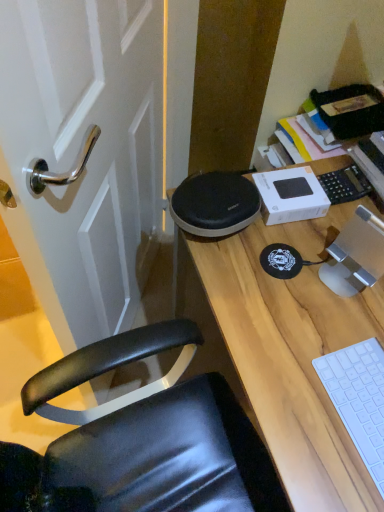
Question: Is white plastic keyboard at lower right situated inside wooden desk at center or outside?

Choices:
 (A) inside
 (B) outside

Answer: (A)

Question: From the image's perspective, relative to wooden desk at center, is white plastic keyboard at lower right above or below?

Choices:
 (A) below
 (B) above

Answer: (B)

Question: Is white plastic keyboard at lower right to the left or to the right of wooden desk at center in the image?

Choices:
 (A) right
 (B) left

Answer: (B)

Question: Would you say wooden desk at center is to the left or to the right of white plastic keyboard at lower right in the picture?

Choices:
 (A) left
 (B) right

Answer: (B)

Question: From a real-world perspective, is wooden desk at center above or below white plastic keyboard at lower right?

Choices:
 (A) below
 (B) above

Answer: (A)

Question: Is wooden desk at center inside or outside of white plastic keyboard at lower right?

Choices:
 (A) outside
 (B) inside

Answer: (A)

Question: Is point 243,320 closer or farther from the camera than point 362,392?

Choices:
 (A) closer
 (B) farther

Answer: (B)